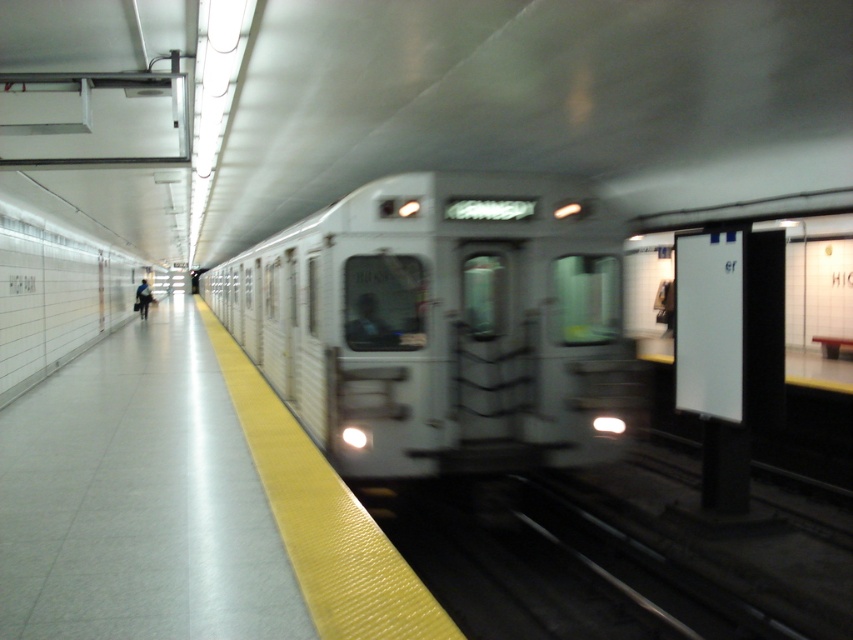
Measure the distance between point (566, 372) and camera.

The distance of point (566, 372) from camera is 21.45 feet.

Does white glossy train at center appear on the left side of dark blue jacket at left?

In fact, white glossy train at center is to the right of dark blue jacket at left.

The image size is (853, 640). What do you see at coordinates (440, 324) in the screenshot?
I see `white glossy train at center` at bounding box center [440, 324].

You are a GUI agent. You are given a task and a screenshot of the screen. Output one action in this format:
    pyautogui.click(x=<x>, y=<y>)
    Task: Click on the white glossy train at center
    This screenshot has width=853, height=640.
    Given the screenshot: What is the action you would take?
    [440, 324]